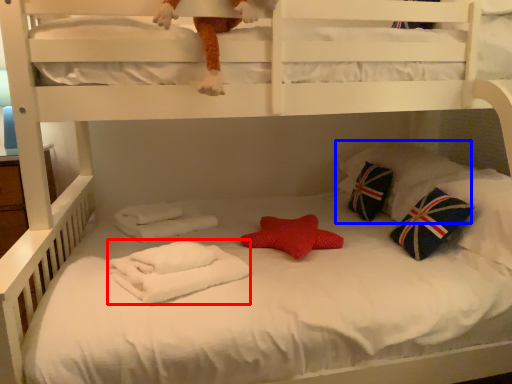
Question: Which object appears farthest to the camera in this image, material (highlighted by a red box) or pillow (highlighted by a blue box)?

Choices:
 (A) material
 (B) pillow

Answer: (B)